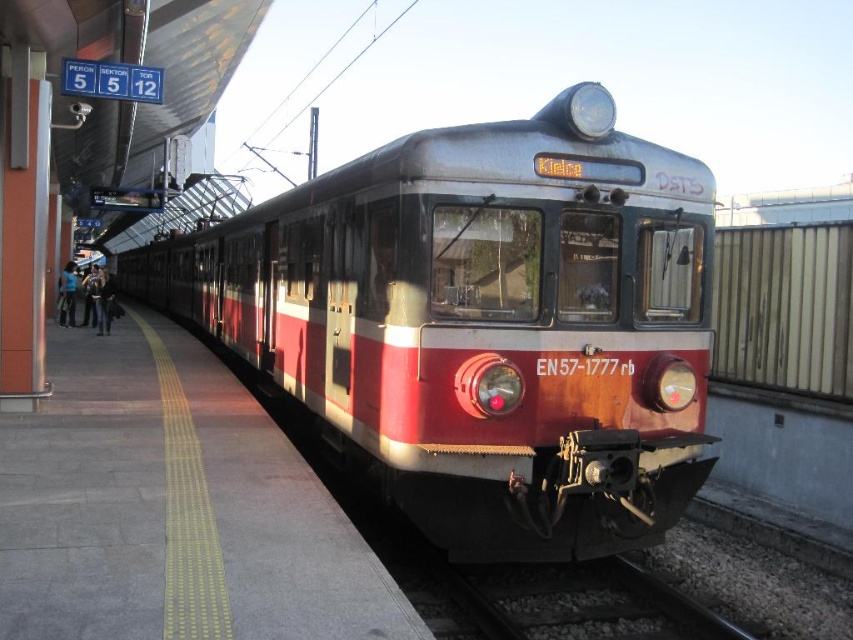
Who is positioned more to the left, red matte train at center or black metal train track at lower center?

red matte train at center

Does red matte train at center appear on the left side of black metal train track at lower center?

Indeed, red matte train at center is positioned on the left side of black metal train track at lower center.

Who is more forward, (422, 362) or (669, 618)?

Positioned in front is point (422, 362).

Where is `red matte train at center`? The width and height of the screenshot is (853, 640). red matte train at center is located at coordinates (482, 324).